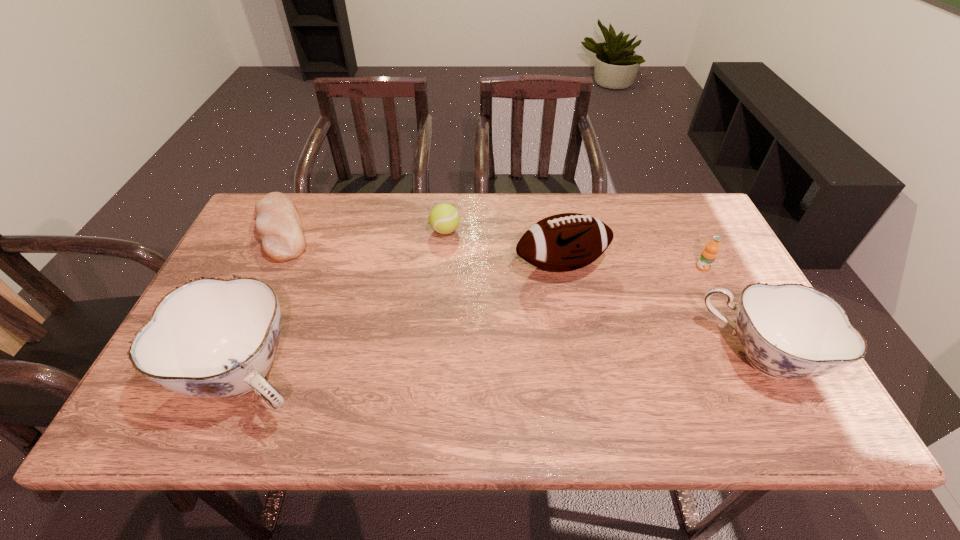
At what (x,y) coordinates should I click in order to perform the action: click on free point between the orange juice and the left chinaware. Please return your answer as a coordinate pair (x, y). The height and width of the screenshot is (540, 960). Looking at the image, I should click on (476, 322).

Where is `unoccupied position between the left chinaware and the second shortest object`? unoccupied position between the left chinaware and the second shortest object is located at coordinates (348, 303).

Where is `vacant space in between the bread and the third shortest object`? This screenshot has width=960, height=540. vacant space in between the bread and the third shortest object is located at coordinates (492, 248).

Where is `vacant area between the orange juice and the taller chinaware`? vacant area between the orange juice and the taller chinaware is located at coordinates (476, 322).

Locate which object is the fifth closest to the second shortest object. Please provide its 2D coordinates. Your answer should be formatted as a tuple, i.e. [(x, y)], where the tuple contains the x and y coordinates of a point satisfying the conditions above.

[(708, 255)]

Image resolution: width=960 pixels, height=540 pixels. I want to click on the third closest object to the shorter chinaware, so click(x=444, y=218).

You are a GUI agent. You are given a task and a screenshot of the screen. Output one action in this format:
    pyautogui.click(x=<x>, y=<y>)
    Task: Click on the vacant space that satisfies the following two spatial constraints: 1. on the label of the orange juice; 2. on the left side of the shorter chinaware
    This screenshot has width=960, height=540.
    Given the screenshot: What is the action you would take?
    pyautogui.click(x=748, y=357)

Where is `blank space that satisfies the following two spatial constraints: 1. on the back side of the taller chinaware; 2. on the right side of the tennis ball`? The image size is (960, 540). blank space that satisfies the following two spatial constraints: 1. on the back side of the taller chinaware; 2. on the right side of the tennis ball is located at coordinates (310, 231).

Where is `vacant space that satisfies the following two spatial constraints: 1. on the front side of the fifth tallest object; 2. on the right side of the third object from right to left`? The width and height of the screenshot is (960, 540). vacant space that satisfies the following two spatial constraints: 1. on the front side of the fifth tallest object; 2. on the right side of the third object from right to left is located at coordinates (443, 265).

The width and height of the screenshot is (960, 540). What are the coordinates of `free space in the image that satisfies the following two spatial constraints: 1. on the front side of the right chinaware; 2. on the right side of the tennis ball` in the screenshot? It's located at (435, 357).